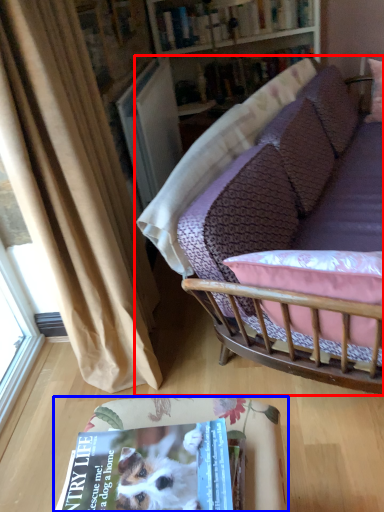
Question: Which point is further to the camera, studio couch (highlighted by a red box) or table (highlighted by a blue box)?

Choices:
 (A) studio couch
 (B) table

Answer: (A)